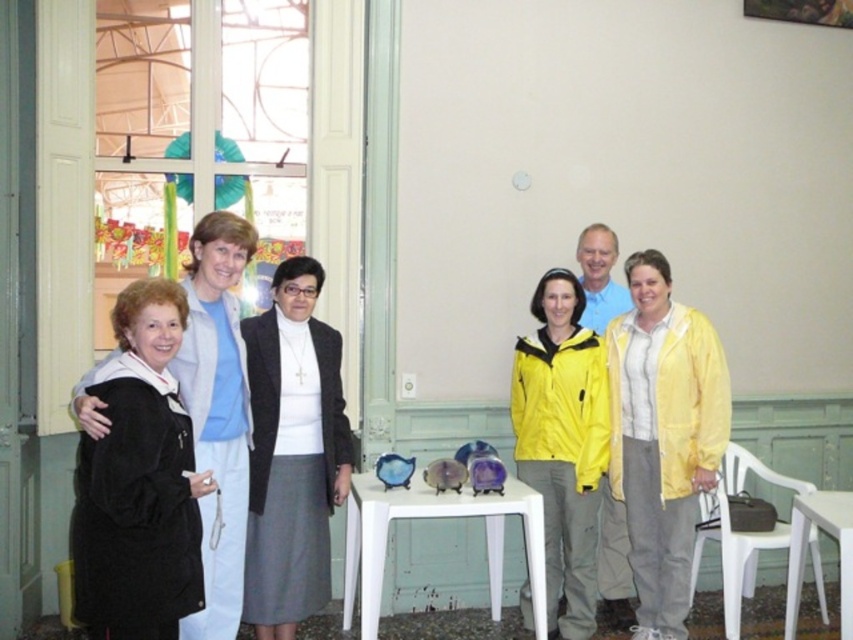
Can you confirm if black matte jacket at center is taller than white plastic chair at lower right?

Yes.

Which of these two, black matte jacket at center or white plastic chair at lower right, stands shorter?

white plastic chair at lower right

This screenshot has height=640, width=853. Identify the location of black matte jacket at center. (292, 452).

Consider the image. Measure the distance between point (282, 289) and camera.

Point (282, 289) and camera are 11.72 feet apart.

Does black matte jacket at left have a larger size compared to black matte jacket at center?

Yes, black matte jacket at left is bigger than black matte jacket at center.

Does point (271, 346) come behind point (300, 556)?

Yes, it is behind point (300, 556).

The image size is (853, 640). Identify the location of black matte jacket at left. (280, 408).

Where is `black velvet coat at left`? The image size is (853, 640). black velvet coat at left is located at coordinates (138, 481).

Find the location of `black velvet coat at left`. black velvet coat at left is located at coordinates (138, 481).